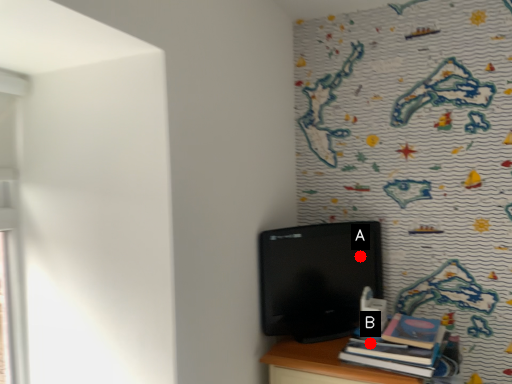
Question: Two points are circled on the image, labeled by A and B beside each circle. Which point appears farthest from the camera in this image?

Choices:
 (A) A is further
 (B) B is further

Answer: (A)